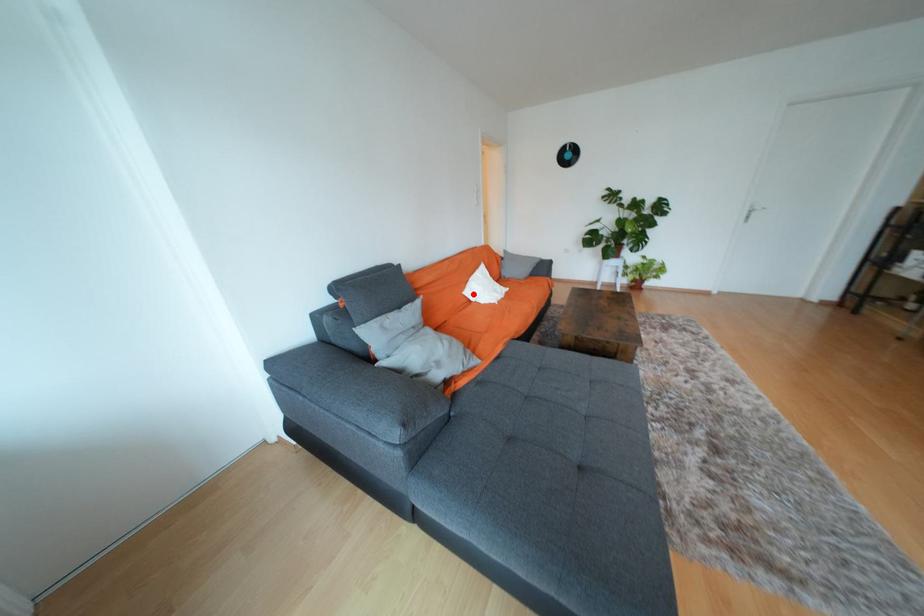
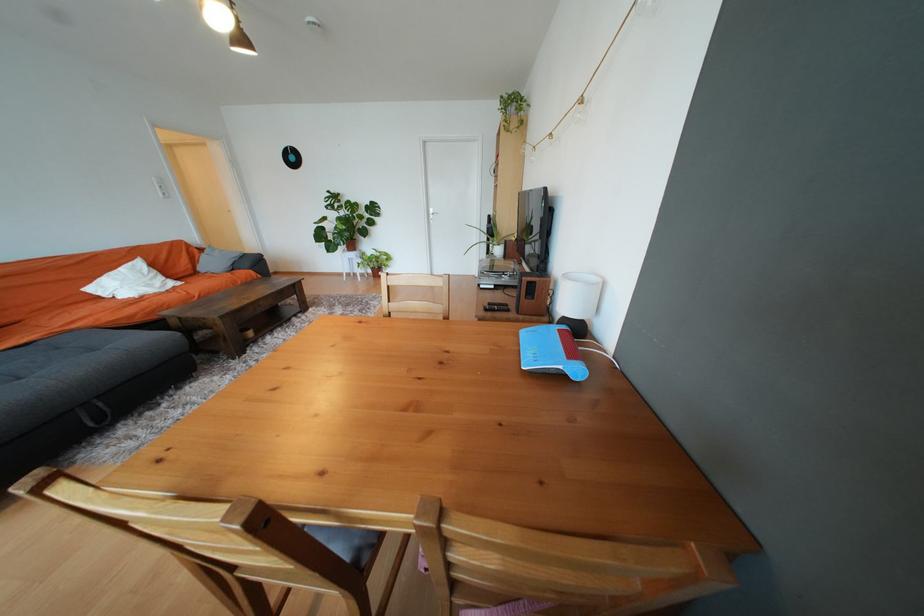
The point at the highlighted location is marked in the first image. Where is the corresponding point in the second image?

(96, 291)